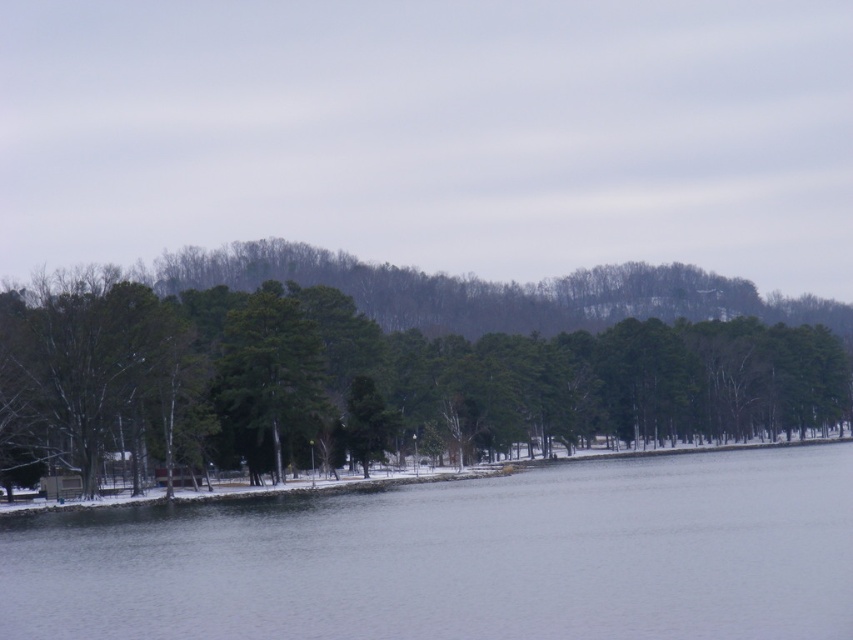
You are standing on the snow covered ground and see the green matte tree at left and the green matte tree at center. Which tree would cast a longer shadow on the snow?

The green matte tree at left is taller than the green matte tree at center, so it would cast a longer shadow on the snow.

You are standing at the point closest to the bottom of the image and want to walk towards the point near the top edge. Are you moving towards the point at coordinates point (15, 301) or point (257, 476)?

You are moving towards point (15, 301) because it is behind point (257, 476), meaning it is further away from your current position at the bottom of the image.